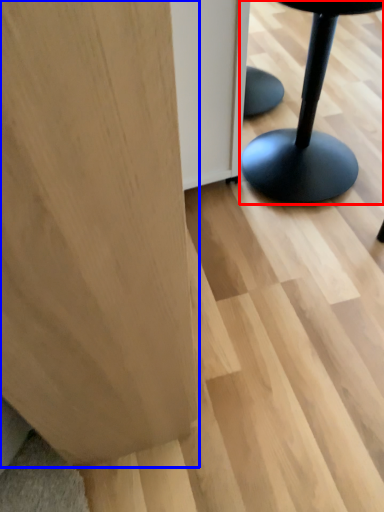
Question: Which object appears farthest to the camera in this image, furniture (highlighted by a red box) or plywood (highlighted by a blue box)?

Choices:
 (A) furniture
 (B) plywood

Answer: (A)